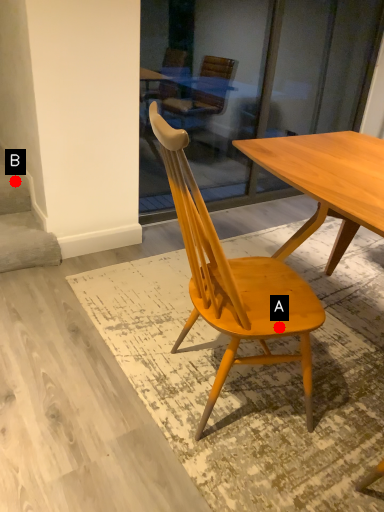
Question: Two points are circled on the image, labeled by A and B beside each circle. Which of the following is the closest to the observer?

Choices:
 (A) A is closer
 (B) B is closer

Answer: (A)